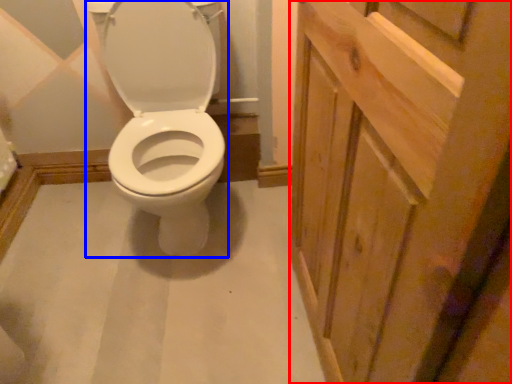
Question: Which object is further to the camera taking this photo, screen door (highlighted by a red box) or sit (highlighted by a blue box)?

Choices:
 (A) screen door
 (B) sit

Answer: (B)